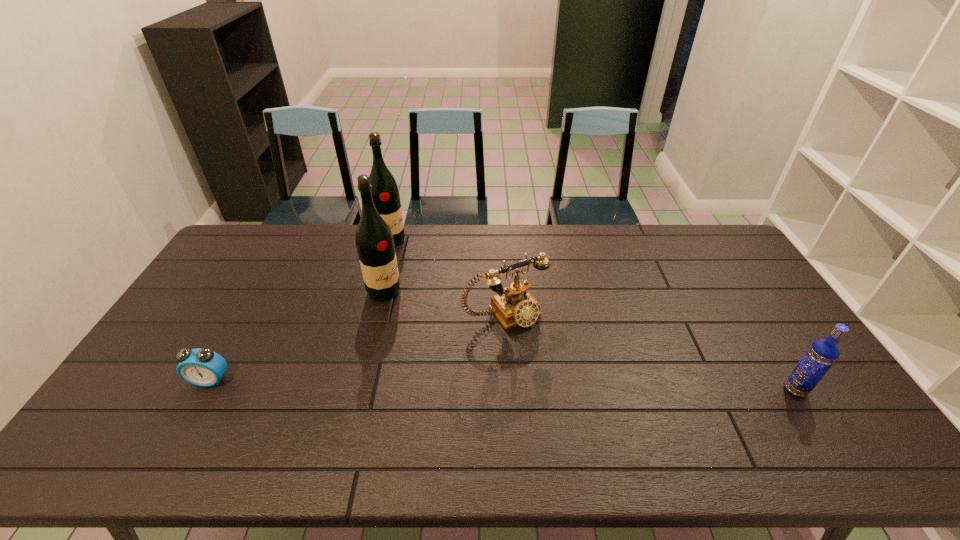
Locate an element on the screen. alarm clock is located at coordinates click(202, 367).

The width and height of the screenshot is (960, 540). I want to click on the shortest object, so click(202, 367).

Locate an element on the screen. the rightmost object is located at coordinates (822, 354).

Identify the location of the third shortest object. (822, 354).

Find the location of a particular element. The image size is (960, 540). the nearer liquor is located at coordinates (375, 246).

The image size is (960, 540). Find the location of `telephone`. telephone is located at coordinates (513, 305).

I want to click on the second shortest object, so click(x=513, y=305).

You are a GUI agent. You are given a task and a screenshot of the screen. Output one action in this format:
    pyautogui.click(x=<x>, y=<y>)
    Task: Click on the farthest object
    Image resolution: width=960 pixels, height=540 pixels.
    Given the screenshot: What is the action you would take?
    [385, 194]

Locate an element on the screen. The height and width of the screenshot is (540, 960). free space located 0.370m on the back of the third tallest object is located at coordinates (731, 288).

The width and height of the screenshot is (960, 540). I want to click on vacant space located on the front-facing side of the nearer liquor, so click(409, 306).